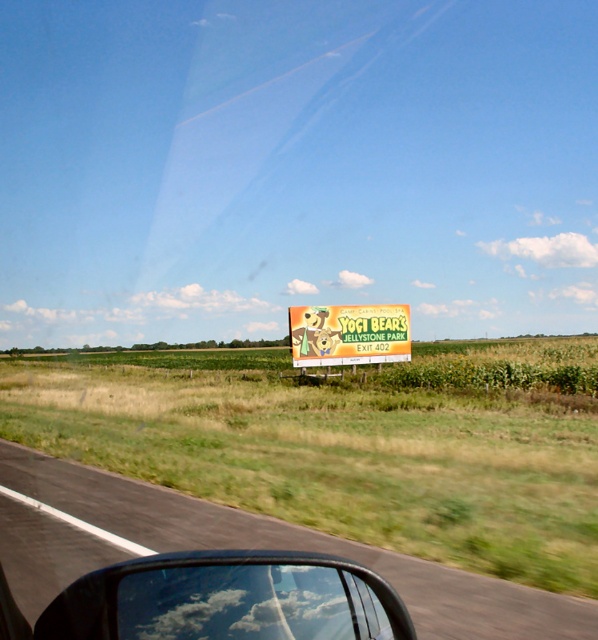
Question: Which is farther from the black asphalt road at center?

Choices:
 (A) yellow cardboard sign at center
 (B) transparent glass car window at lower center

Answer: (A)

Question: Which object is closer to the camera taking this photo?

Choices:
 (A) transparent glass car window at lower center
 (B) black asphalt road at center

Answer: (A)

Question: Does transparent glass car window at lower center appear over yellow cardboard sign at center?

Choices:
 (A) no
 (B) yes

Answer: (A)

Question: In this image, where is black asphalt road at center located relative to transparent glass car window at lower center?

Choices:
 (A) right
 (B) left

Answer: (B)

Question: Which object is farther from the camera taking this photo?

Choices:
 (A) transparent glass car window at lower center
 (B) yellow cardboard sign at center
 (C) black asphalt road at center

Answer: (B)

Question: Can you confirm if black asphalt road at center is positioned to the right of transparent glass car window at lower center?

Choices:
 (A) no
 (B) yes

Answer: (A)